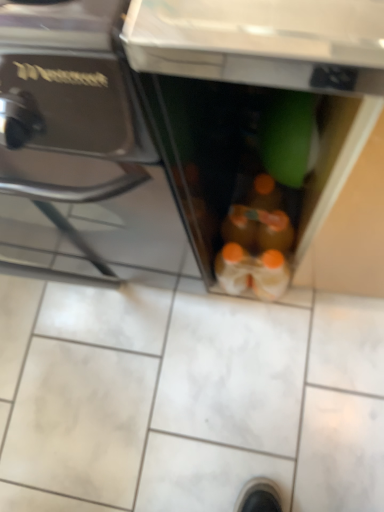
Where is `stainless steel oven at left`? This screenshot has width=384, height=512. stainless steel oven at left is located at coordinates (68, 114).

The width and height of the screenshot is (384, 512). What do you see at coordinates (68, 114) in the screenshot?
I see `stainless steel oven at left` at bounding box center [68, 114].

What is the approximate width of stainless steel oven at left?

stainless steel oven at left is 64.47 centimeters in width.

You are a GUI agent. You are given a task and a screenshot of the screen. Output one action in this format:
    pyautogui.click(x=<x>, y=<y>)
    Task: Click on the stainless steel oven at left
    This screenshot has height=512, width=384.
    Given the screenshot: What is the action you would take?
    pyautogui.click(x=68, y=114)